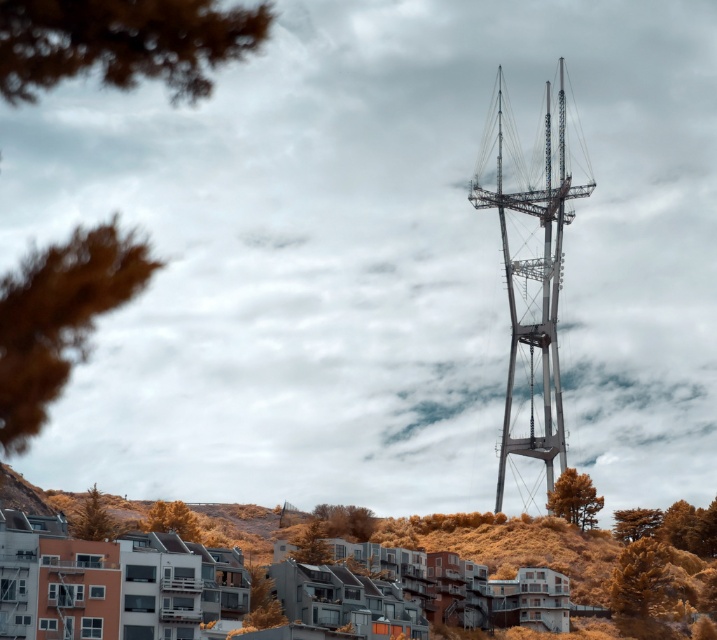
You are standing in the urban landscape and want to take a photo of both the golden textured tree at lower left and the green textured tree at lower right. Which tree should you position closer to the center of your camera frame to include both in the shot?

To include both the golden textured tree at lower left and the green textured tree at lower right in the photo, you should position the golden textured tree at lower left closer to the center of your camera frame since it is to the left of the green textured tree at lower right.

You are a city planner reviewing an urban layout. You notice a golden textured tree at lower left marked by point (262,600). Is this tree closer to the residential buildings or the telecommunications tower?

The golden textured tree at lower left marked by point (262,600) is closer to the residential buildings because it is located in the foreground where the residential area is situated, while the telecommunications tower stands prominently in the background against the cloudy sky.

You are standing in the urban landscape and want to take a photo of both the golden textured tree at lower left and the green textured tree at lower right. Which tree should you focus on first to ensure both are in clear view?

You should focus on the golden textured tree at lower left first because it is closer to you than the green textured tree at lower right. By focusing on the closer tree, the farther one will also be in focus due to depth of field.